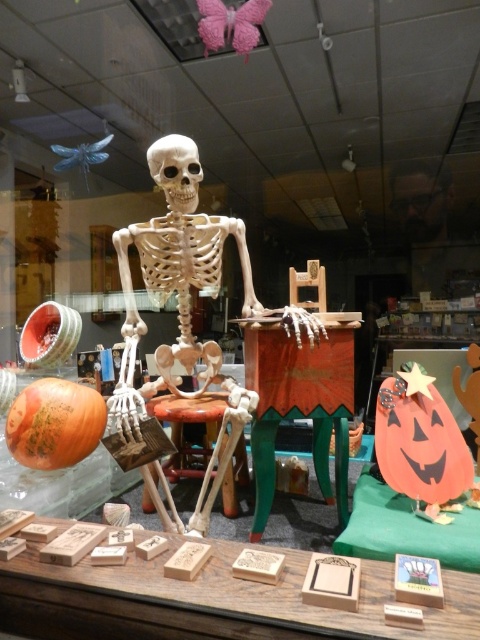
Based on the photo, you are standing in front of the Halloween display and want to know which of the two points, point (427, 268) or point (193, 157), is closer to you. Can you determine this based on their positions?

Point (193, 157) is closer to you because it is less further to the camera than point (427, 268).

You are a customer looking at the Halloween display. You notice the smooth beige skull at center and the wooden stool at center. Which object is positioned higher in the scene?

The smooth beige skull at center is located above the wooden stool at center, so it is positioned higher in the scene.

You are a customer looking at the Halloween display through the store window. You notice two points marked in the scene. Which point is closer to you, point (126, 419) or point (218, 403)?

Point (126, 419) is closer to the viewer than point (218, 403).